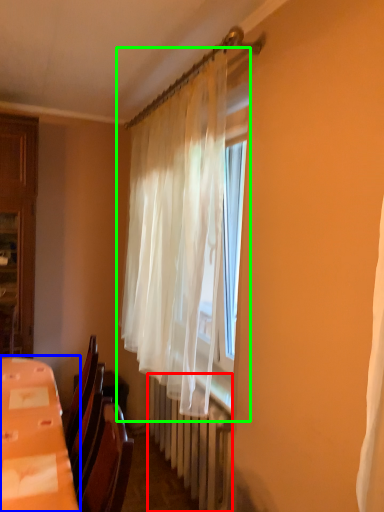
Question: Considering the real-world distances, which object is farthest from radiator (highlighted by a red box)? table (highlighted by a blue box) or curtain (highlighted by a green box)?

Choices:
 (A) table
 (B) curtain

Answer: (A)